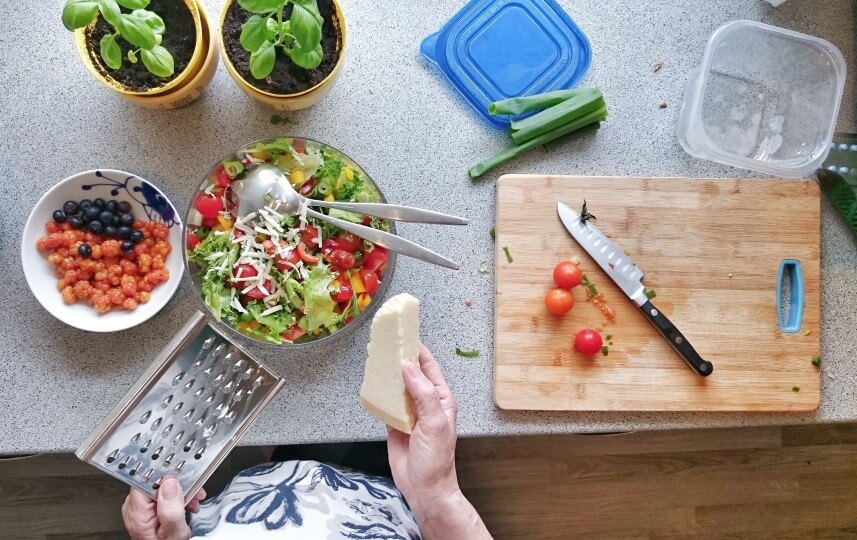
Locate an element on the screen. grater is located at coordinates (189, 402).